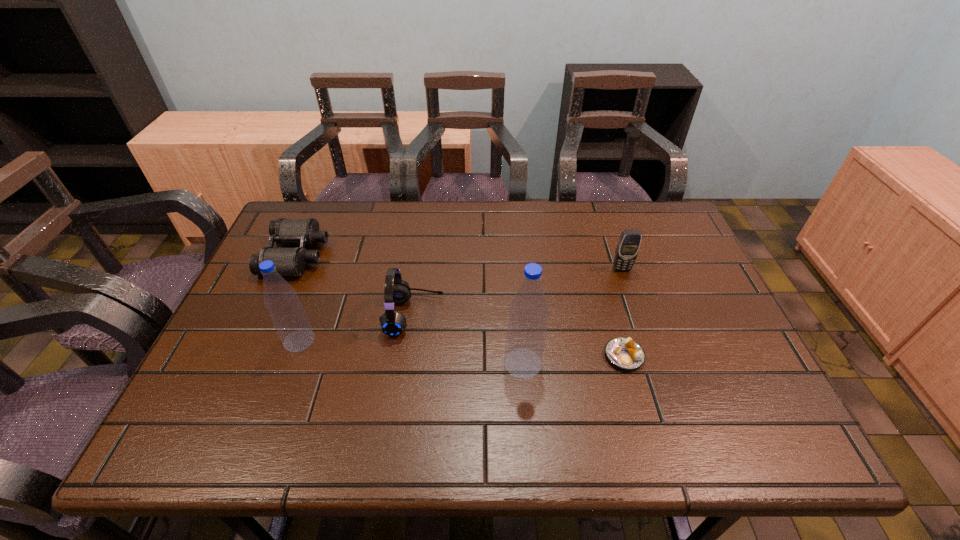
You are a GUI agent. You are given a task and a screenshot of the screen. Output one action in this format:
    pyautogui.click(x=<x>, y=<y>)
    Task: Click on the left water bottle
    
    Given the screenshot: What is the action you would take?
    pyautogui.click(x=287, y=314)

Identify the location of the second tallest object. (287, 314).

You are a GUI agent. You are given a task and a screenshot of the screen. Output one action in this format:
    pyautogui.click(x=<x>, y=<y>)
    Task: Click on the third object from right to left
    The width and height of the screenshot is (960, 540).
    Given the screenshot: What is the action you would take?
    pyautogui.click(x=528, y=313)

This screenshot has width=960, height=540. I want to click on the right water bottle, so click(528, 313).

Locate an element on the screen. This screenshot has width=960, height=540. cellular telephone is located at coordinates (629, 242).

The width and height of the screenshot is (960, 540). Find the location of `the fourth object from right to left`. the fourth object from right to left is located at coordinates (396, 290).

The height and width of the screenshot is (540, 960). I want to click on pastry, so click(x=625, y=353).

Image resolution: width=960 pixels, height=540 pixels. In order to click on the second shortest object in this screenshot , I will do `click(288, 261)`.

The image size is (960, 540). What are the coordinates of `free point located 0.310m on the back of the left water bottle` in the screenshot? It's located at (333, 248).

Locate an element on the screen. The image size is (960, 540). vacant area located on the right of the fourth object from left to right is located at coordinates (619, 363).